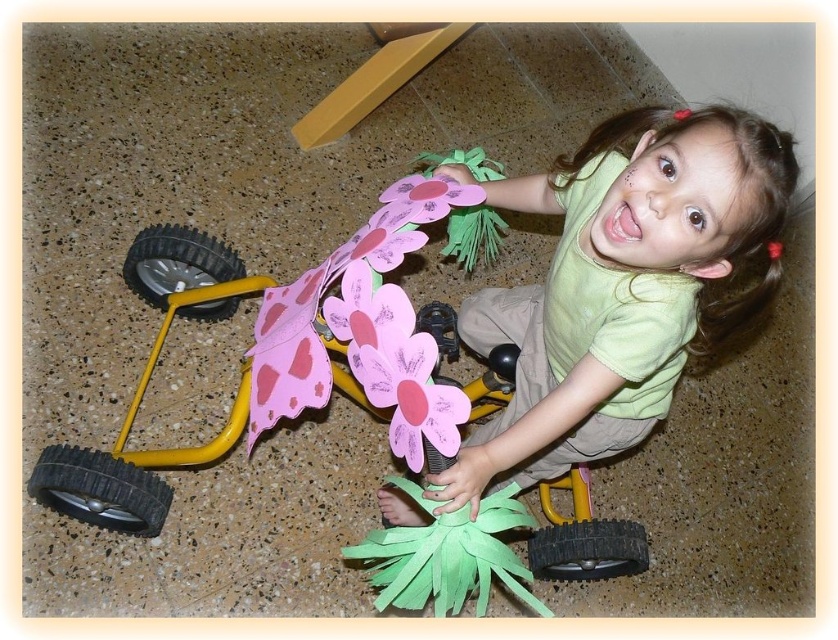
Who is lower down, green matte shirt at upper center or yellow plastic toy car at lower left?

green matte shirt at upper center is below.

Which is more to the right, green matte shirt at upper center or yellow plastic toy car at lower left?

From the viewer's perspective, green matte shirt at upper center appears more on the right side.

Is point (549, 371) in front of point (378, 236)?

No, it is behind (378, 236).

Where is `green matte shirt at upper center`? This screenshot has width=838, height=640. green matte shirt at upper center is located at coordinates (622, 284).